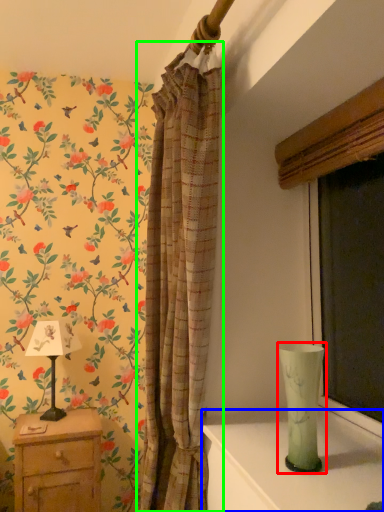
Question: Which is nearer to the glass vase (highlighted by a red box)? table (highlighted by a blue box) or curtain (highlighted by a green box).

Choices:
 (A) table
 (B) curtain

Answer: (A)